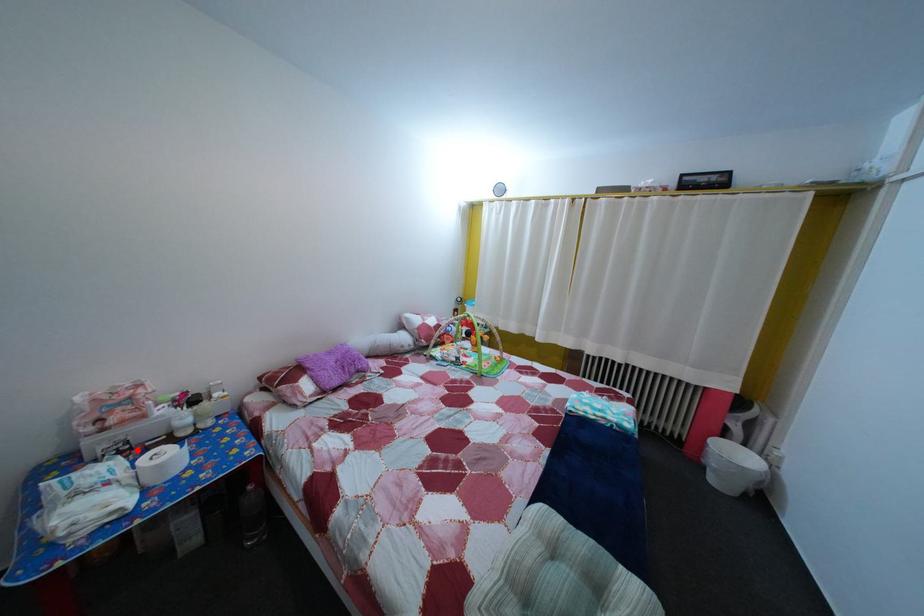
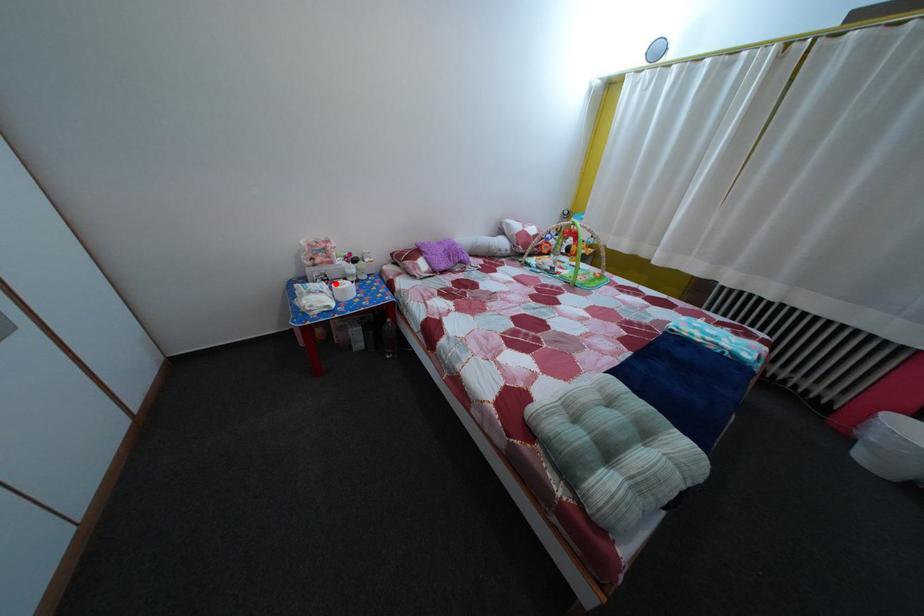
I am providing you with two images of the same scene from different viewpoints. A red point is marked on the first image and another point is marked on the second image. Is the red point in image1 aligned with the point shown in image2?

Yes